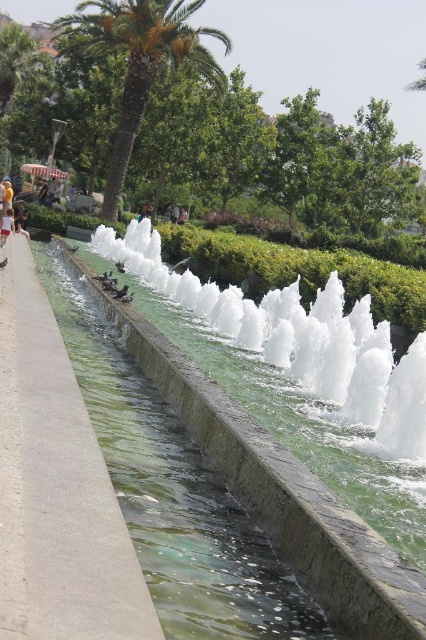
Can you confirm if clear glass water at center is thinner than light skin human at lower left?

No.

Can you confirm if clear glass water at center is smaller than light skin human at lower left?

No.

Where is `clear glass water at center`? The image size is (426, 640). clear glass water at center is located at coordinates (279, 490).

This screenshot has height=640, width=426. Identify the location of clear glass water at center. (279, 490).

Is green leafy palm tree at upper left positioned behind white cotton shirt at center?

Yes, it is.

Is point (100, 20) more distant than point (5, 220)?

Yes, it is behind point (5, 220).

I want to click on green leafy palm tree at upper left, so click(140, 60).

How much distance is there between gray concrete pavement at center and white cotton shirt at center?

A distance of 121.50 feet exists between gray concrete pavement at center and white cotton shirt at center.

This screenshot has height=640, width=426. Identify the location of gray concrete pavement at center. (55, 488).

Find the location of `gray concrete pavement at center`. gray concrete pavement at center is located at coordinates (55, 488).